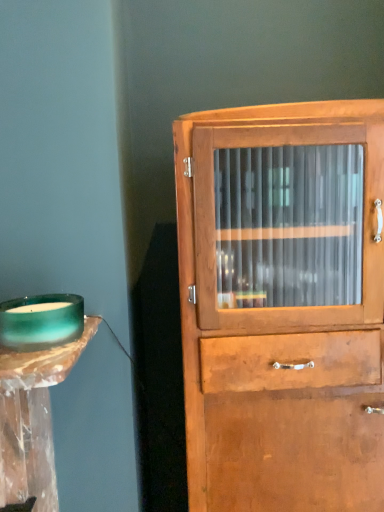
Find the location of a particular element. Image resolution: width=384 pixels, height=512 pixels. wooden cabinet at center is located at coordinates (283, 305).

What do you see at coordinates (283, 305) in the screenshot?
I see `wooden cabinet at center` at bounding box center [283, 305].

What do you see at coordinates (41, 321) in the screenshot?
I see `teal glass candle holder at left` at bounding box center [41, 321].

The height and width of the screenshot is (512, 384). I want to click on teal glass candle holder at left, so click(x=41, y=321).

What is the approximate width of teal glass candle holder at left?

The width of teal glass candle holder at left is 7.85 inches.

Where is `wooden cabinet at center`? wooden cabinet at center is located at coordinates (283, 305).

Is teal glass candle holder at left to the right of wooden cabinet at center from the viewer's perspective?

Incorrect, teal glass candle holder at left is not on the right side of wooden cabinet at center.

Relative to wooden cabinet at center, is teal glass candle holder at left in front or behind?

teal glass candle holder at left is positioned closer to the viewer than wooden cabinet at center.

Is point (74, 308) farther from viewer compared to point (303, 178)?

No.

From the image's perspective, which is above, teal glass candle holder at left or wooden cabinet at center?

From the image's view, teal glass candle holder at left is above.

From a real-world perspective, does teal glass candle holder at left stand above wooden cabinet at center?

Yes, from a real-world perspective, teal glass candle holder at left is above wooden cabinet at center.

Is teal glass candle holder at left thinner than wooden cabinet at center?

Indeed, teal glass candle holder at left has a lesser width compared to wooden cabinet at center.

Considering the relative sizes of teal glass candle holder at left and wooden cabinet at center in the image provided, is teal glass candle holder at left taller than wooden cabinet at center?

Incorrect, the height of teal glass candle holder at left is not larger of that of wooden cabinet at center.

Is teal glass candle holder at left bigger than wooden cabinet at center?

Actually, teal glass candle holder at left might be smaller than wooden cabinet at center.

Which is correct: teal glass candle holder at left is inside wooden cabinet at center, or outside of it?

teal glass candle holder at left is not enclosed by wooden cabinet at center.

Are teal glass candle holder at left and wooden cabinet at center making contact?

No, teal glass candle holder at left is not with wooden cabinet at center.

From the picture: Is teal glass candle holder at left aimed at wooden cabinet at center?

No, teal glass candle holder at left does not turn towards wooden cabinet at center.

This screenshot has height=512, width=384. What are the coordinates of `candle holder above the wooden cabinet at center (from the image's perspective)` in the screenshot? It's located at (41, 321).

Visually, is wooden cabinet at center positioned to the left or to the right of teal glass candle holder at left?

In the image, wooden cabinet at center appears on the right side of teal glass candle holder at left.

Does wooden cabinet at center lie behind teal glass candle holder at left?

Yes, wooden cabinet at center is further from the camera.

Does point (227, 477) appear closer or farther from the camera than point (42, 313)?

Point (227, 477) appears to be farther away from the viewer than point (42, 313).

From the image's perspective, would you say wooden cabinet at center is shown under teal glass candle holder at left?

Yes.

From a real-world perspective, is wooden cabinet at center over teal glass candle holder at left?

No, from a real-world perspective, wooden cabinet at center is not above teal glass candle holder at left.

Looking at their sizes, would you say wooden cabinet at center is wider or thinner than teal glass candle holder at left?

Clearly, wooden cabinet at center has more width compared to teal glass candle holder at left.

Does wooden cabinet at center have a greater height compared to teal glass candle holder at left?

Yes.

Who is bigger, wooden cabinet at center or teal glass candle holder at left?

wooden cabinet at center.

Is teal glass candle holder at left a part of wooden cabinet at center?

Actually, teal glass candle holder at left is outside wooden cabinet at center.

Is wooden cabinet at center in contact with teal glass candle holder at left?

wooden cabinet at center and teal glass candle holder at left are clearly separated.

Is wooden cabinet at center turned away from teal glass candle holder at left?

No.

How many degrees apart are the facing directions of wooden cabinet at center and teal glass candle holder at left?

The angle between the facing direction of wooden cabinet at center and the facing direction of teal glass candle holder at left is 1.38 degrees.

How far apart are wooden cabinet at center and teal glass candle holder at left?

They are 17.42 inches apart.

The height and width of the screenshot is (512, 384). In order to click on candle holder lying above the wooden cabinet at center (from the image's perspective) in this screenshot , I will do `click(41, 321)`.

In the image, there is a wooden cabinet at center. In order to click on candle holder above it (from the image's perspective) in this screenshot , I will do `click(41, 321)`.

Identify the location of cupboard lying on the right of teal glass candle holder at left. The image size is (384, 512). (283, 305).